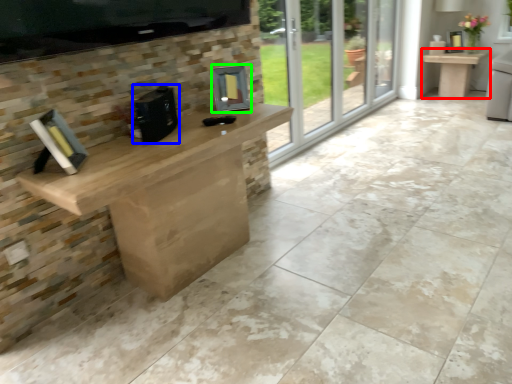
Question: Which object is positioned closest to table (highlighted by a red box)? Select from appliance (highlighted by a blue box) and appliance (highlighted by a green box).

Choices:
 (A) appliance
 (B) appliance

Answer: (B)